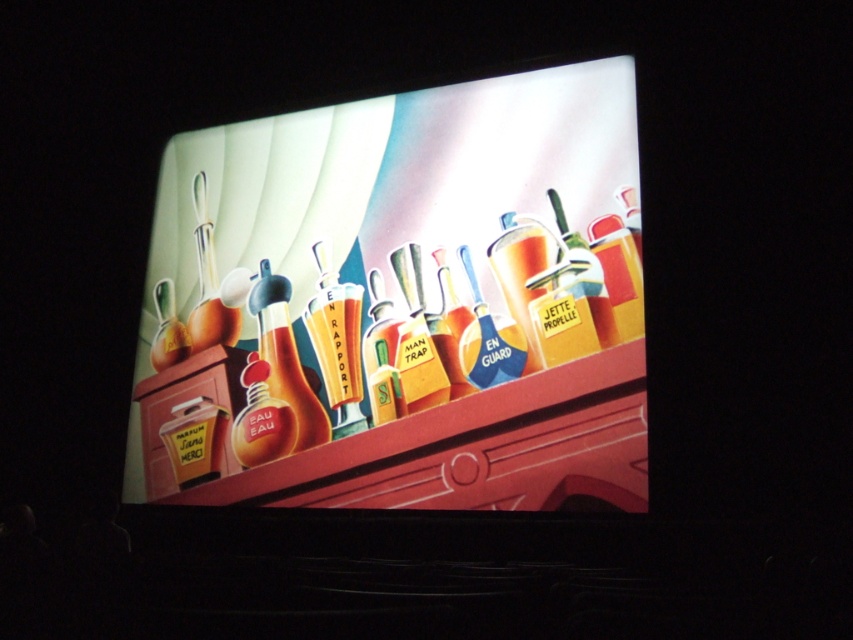
You are standing in front of the colorful illustration on the screen and see the point at coordinates (416, 339). Which object from the list below is located exactly at that point? Choose from the options provided. The options are the objects listed in the scene description.

The point at coordinates (416, 339) is located on the yellow matte bottle at center.

You are an assistant organizing bottles on a table. You notice two points marked on the table surface at coordinates point (424, 352) and point (515, 362). Which point is closer to you when viewed from the front of the table?

Point (424, 352) is behind point (515, 362), so the point closer to you would be point (515, 362) since it is in front.